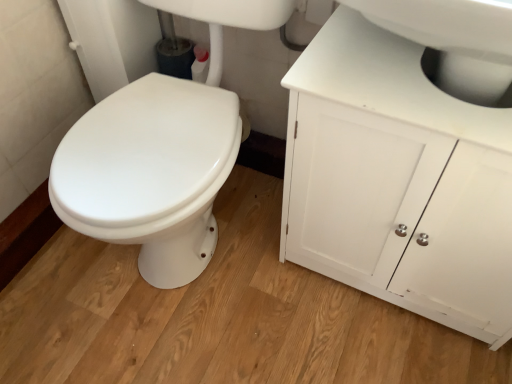
Identify the location of free spot below white glossy sink at upper right (from a real-world perspective). Image resolution: width=512 pixels, height=384 pixels. (388, 62).